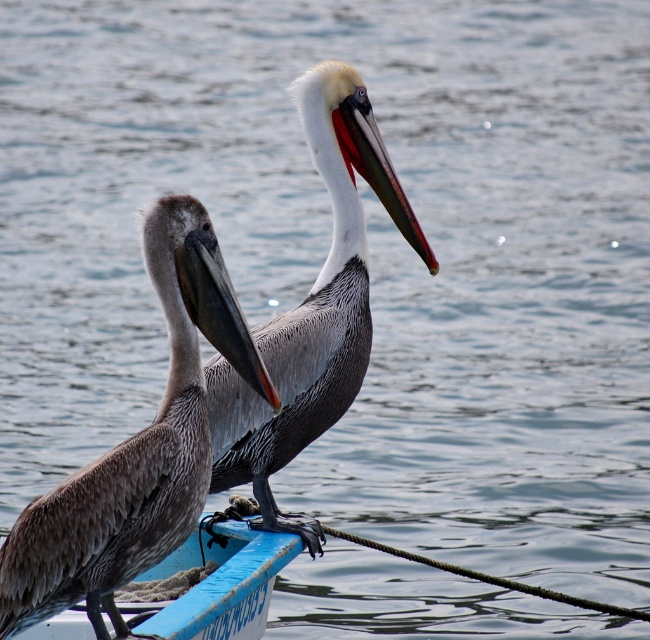
You are a wildlife photographer aiming to capture a closeup shot of both the brown feathered pelican at center and the brown speckled pelican at center. Given that your camera has a minimum focusing distance of 5 feet, will you be able to take the photo without moving closer?

The distance between the brown feathered pelican at center and the brown speckled pelican at center is 6.07 feet. Since the camera requires a minimum focusing distance of 5 feet, the photographer can take the photo without moving closer as the distance exceeds the required minimum.

Consider the image. You are a wildlife photographer trying to capture a photo of the brown speckled pelican at center and the blue plastic boat at center. You need to ensure that both subjects are clearly visible in the frame. Given their sizes, which subject should you focus on first to ensure proper framing?

The brown speckled pelican at center is larger in size than the blue plastic boat at center, so you should focus on the brown speckled pelican at center first to ensure it fits well within the frame before adjusting for the smaller boat.

You are standing on the deck of a large cruise ship that is 20 feet away from the small boat with the brown feathered pelican at center. If you want to toss a fish to the pelican, will you be able to reach it with a throw?

The brown feathered pelican at center is 20.16 feet away from the viewer. Since the distance between you and the pelican is slightly more than 20 feet, you would need to throw the fish a bit further to reach it.